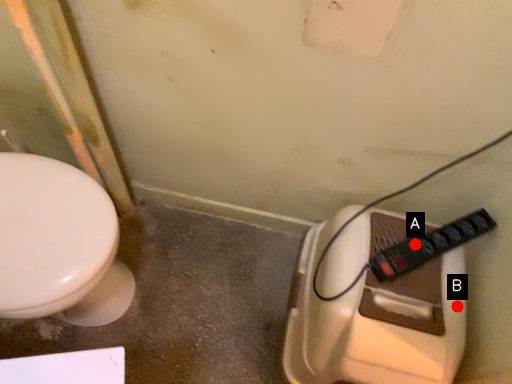
Question: Two points are circled on the image, labeled by A and B beside each circle. Which point is closer to the camera?

Choices:
 (A) A is closer
 (B) B is closer

Answer: (A)